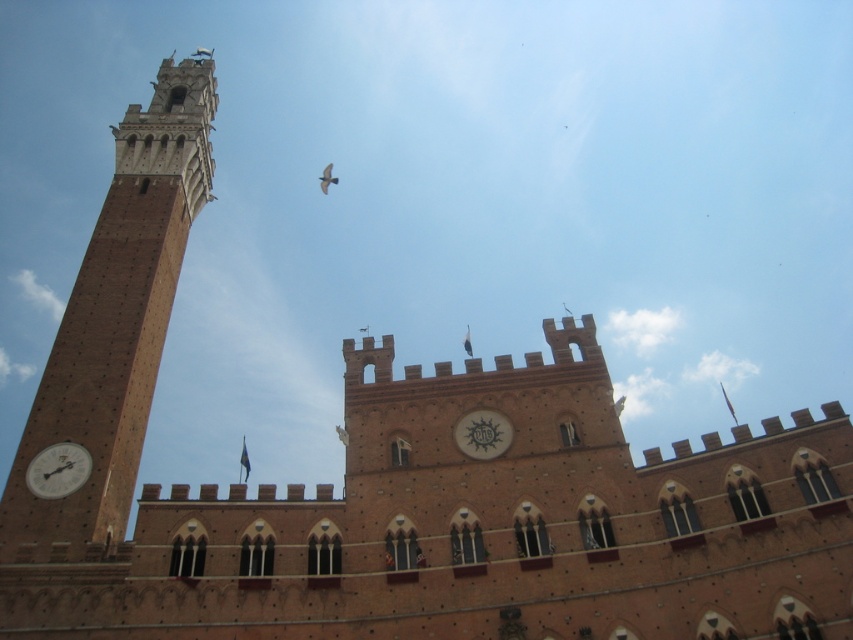
Does brown brick bell tower at left appear on the right side of matte brown clock at left?

In fact, brown brick bell tower at left is to the left of matte brown clock at left.

Which is above, brown brick bell tower at left or matte brown clock at left?

Positioned higher is brown brick bell tower at left.

Locate an element on the screen. This screenshot has width=853, height=640. brown brick bell tower at left is located at coordinates (115, 321).

Identify the location of brown brick bell tower at left. (115, 321).

Looking at this image, between matte brown clock at left and white glossy clock at center, which one appears on the left side from the viewer's perspective?

matte brown clock at left is more to the left.

Who is more distant from viewer, (73, 456) or (479, 416)?

Point (479, 416)

Describe the element at coordinates (57, 470) in the screenshot. Image resolution: width=853 pixels, height=640 pixels. I see `matte brown clock at left` at that location.

Identify the location of matte brown clock at left. (57, 470).

Who is more distant from viewer, (158, 227) or (486, 420)?

The point (158, 227) is behind.

Is point (164, 161) closer to viewer compared to point (494, 438)?

No, (164, 161) is further to viewer.

The height and width of the screenshot is (640, 853). I want to click on brown brick bell tower at left, so (115, 321).

Image resolution: width=853 pixels, height=640 pixels. Find the location of `brown brick bell tower at left`. brown brick bell tower at left is located at coordinates (115, 321).